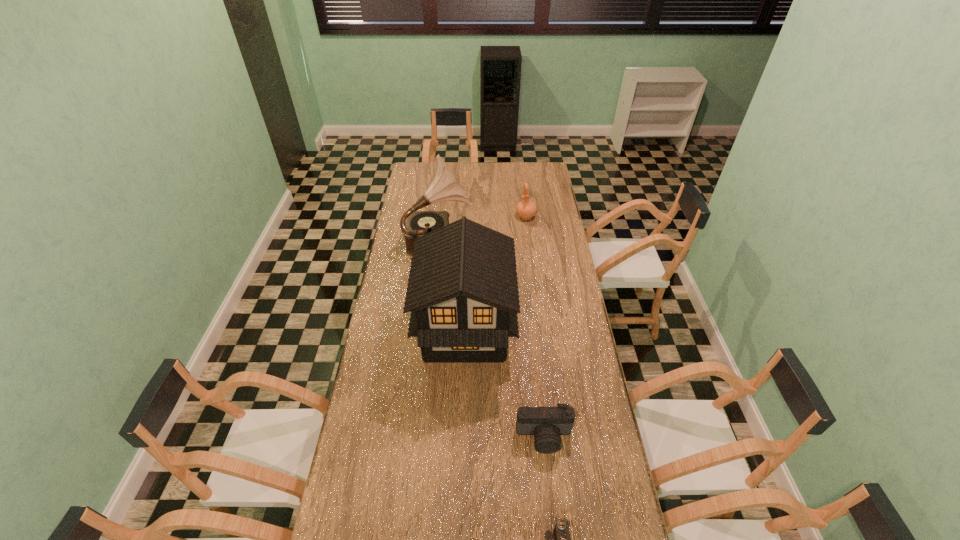
Where is `pottery present at the right edge`? pottery present at the right edge is located at coordinates (526, 209).

Locate an element on the screen. The height and width of the screenshot is (540, 960). camera present at the right edge is located at coordinates (546, 424).

Locate an element on the screen. The width and height of the screenshot is (960, 540). blank space at the far edge of the desktop is located at coordinates (489, 164).

At what (x,y) coordinates should I click in order to perform the action: click on vacant space at the left edge of the desktop. Please return your answer as a coordinate pair (x, y). Looking at the image, I should click on (368, 422).

Identify the location of blank space at the right edge. The image size is (960, 540). (553, 265).

Locate an element on the screen. The height and width of the screenshot is (540, 960). vacant space that is in between the third nearest object and the taller camera is located at coordinates (505, 383).

At what (x,y) coordinates should I click in order to perform the action: click on free spot between the dollhouse and the fourth farthest object. Please return your answer as a coordinate pair (x, y). The width and height of the screenshot is (960, 540). Looking at the image, I should click on (505, 383).

Identify which object is the second closest to the third tallest object. Please provide its 2D coordinates. Your answer should be formatted as a tuple, i.e. [(x, y)], where the tuple contains the x and y coordinates of a point satisfying the conditions above.

[(462, 293)]

Select which object appears as the fourth closest to the farther camera. Please provide its 2D coordinates. Your answer should be formatted as a tuple, i.e. [(x, y)], where the tuple contains the x and y coordinates of a point satisfying the conditions above.

[(526, 209)]

Find the location of a particular element. This screenshot has width=960, height=540. free space in the image that satisfies the following two spatial constraints: 1. on the spout of the pottery; 2. on the front-facing side of the third farthest object is located at coordinates (540, 330).